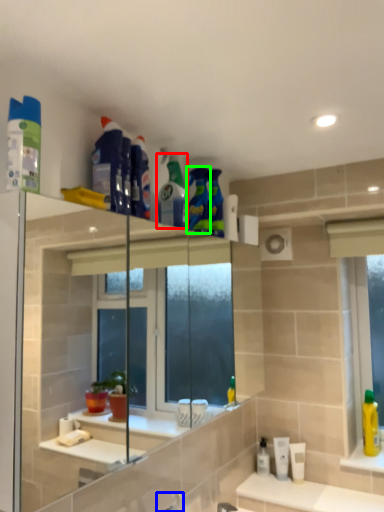
Question: Considering the real-world distances, which object is closest to cleaning product (highlighted by a red box)? faucet (highlighted by a blue box) or cleaning product (highlighted by a green box).

Choices:
 (A) faucet
 (B) cleaning product

Answer: (B)